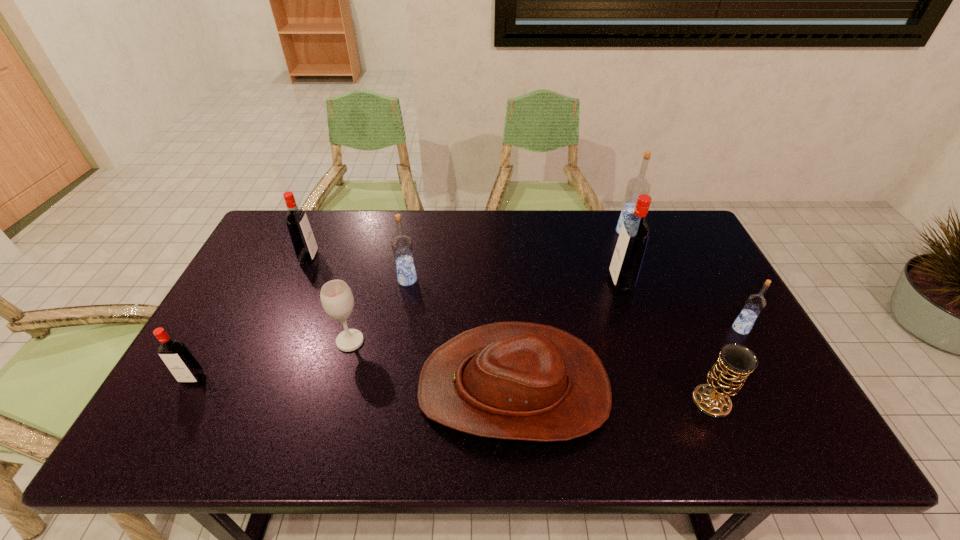
This screenshot has width=960, height=540. I want to click on vodka that stands as the second closest to the leftmost object, so pyautogui.click(x=402, y=246).

Identify which vodka is the fifth nearest to the eighth nearest object. Please provide its 2D coordinates. Your answer should be formatted as a tuple, i.e. [(x, y)], where the tuple contains the x and y coordinates of a point satisfying the conditions above.

[(755, 303)]

You are a GUI agent. You are given a task and a screenshot of the screen. Output one action in this format:
    pyautogui.click(x=<x>, y=<y>)
    Task: Click on the blue vodka identified as the second closest to the nearest blue vodka
    Image resolution: width=960 pixels, height=540 pixels.
    Given the screenshot: What is the action you would take?
    pyautogui.click(x=402, y=246)

Identify which blue vodka is located as the nearest to the nearest blue vodka. Please provide its 2D coordinates. Your answer should be formatted as a tuple, i.e. [(x, y)], where the tuple contains the x and y coordinates of a point satisfying the conditions above.

[(639, 185)]

Locate which red vodka ranks in proximity to the smallest red vodka. Please provide its 2D coordinates. Your answer should be formatted as a tuple, i.e. [(x, y)], where the tuple contains the x and y coordinates of a point satisfying the conditions above.

[(303, 241)]

Identify which red vodka is the third closest to the farthest vodka. Please provide its 2D coordinates. Your answer should be formatted as a tuple, i.e. [(x, y)], where the tuple contains the x and y coordinates of a point satisfying the conditions above.

[(185, 368)]

You are a GUI agent. You are given a task and a screenshot of the screen. Output one action in this format:
    pyautogui.click(x=<x>, y=<y>)
    Task: Click on the free location that satisfies the following two spatial constraints: 1. on the front and back of the second object from left to right; 2. on the front and back of the leftmost object
    
    Given the screenshot: What is the action you would take?
    pyautogui.click(x=256, y=379)

You are a GUI agent. You are given a task and a screenshot of the screen. Output one action in this format:
    pyautogui.click(x=<x>, y=<y>)
    Task: Click on the free point that satisfies the following two spatial constraints: 1. on the front and back of the third vodka from right to left; 2. on the left side of the chalice
    The height and width of the screenshot is (540, 960).
    Given the screenshot: What is the action you would take?
    pyautogui.click(x=661, y=401)

The width and height of the screenshot is (960, 540). In order to click on free location that satisfies the following two spatial constraints: 1. on the front and back of the rightmost red vodka; 2. on the front side of the wineglass in this screenshot , I will do `click(640, 341)`.

Locate an element on the screen. The image size is (960, 540). free location that satisfies the following two spatial constraints: 1. on the back side of the nearest blue vodka; 2. on the right side of the chalice is located at coordinates (x=680, y=329).